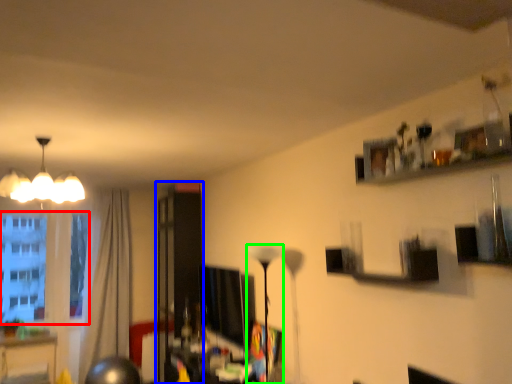
Question: Estimate the real-world distances between objects in this image. Which object is farther from window screen (highlighted by a red box), glass door (highlighted by a blue box) or lamp (highlighted by a green box)?

Choices:
 (A) glass door
 (B) lamp

Answer: (B)